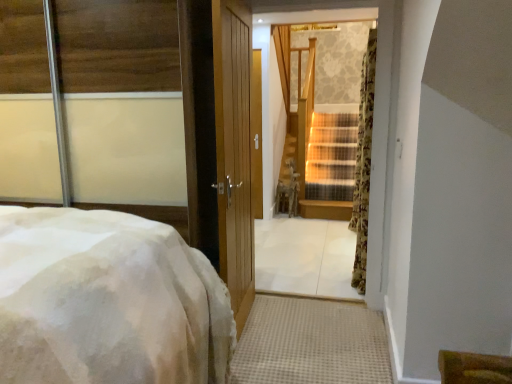
The image size is (512, 384). What do you see at coordinates (362, 164) in the screenshot?
I see `floral fabric curtain at right` at bounding box center [362, 164].

The image size is (512, 384). Describe the element at coordinates (334, 108) in the screenshot. I see `wooden staircase at center` at that location.

Where is `white fluffy bed at left`? This screenshot has height=384, width=512. white fluffy bed at left is located at coordinates (106, 301).

Looking at this image, considering the relative positions of floral fabric curtain at right and white fluffy bed at left in the image provided, is floral fabric curtain at right in front of white fluffy bed at left?

No, it is not.

Where is `bed on the left of floral fabric curtain at right`? The height and width of the screenshot is (384, 512). bed on the left of floral fabric curtain at right is located at coordinates (106, 301).

Would you say floral fabric curtain at right is inside or outside white fluffy bed at left?

The correct answer is: outside.

Is white fluffy bed at left behind wooden staircase at center?

No.

Does point (22, 232) appear closer or farther from the camera than point (329, 290)?

Clearly, point (22, 232) is closer to the camera than point (329, 290).

Is white fluffy bed at left far from wooden staircase at center?

Yes, white fluffy bed at left and wooden staircase at center are located far from each other.

Considering the relative sizes of white fluffy bed at left and wooden staircase at center in the image provided, is white fluffy bed at left taller than wooden staircase at center?

No, white fluffy bed at left is not taller than wooden staircase at center.

Considering the relative positions of white fluffy bed at left and floral fabric curtain at right in the image provided, is white fluffy bed at left to the left or to the right of floral fabric curtain at right?

From the image, it's evident that white fluffy bed at left is to the left of floral fabric curtain at right.

Does white fluffy bed at left have a greater height compared to floral fabric curtain at right?

Incorrect, the height of white fluffy bed at left is not larger of that of floral fabric curtain at right.

Is white fluffy bed at left wider or thinner than floral fabric curtain at right?

white fluffy bed at left is wider than floral fabric curtain at right.

In terms of width, does floral fabric curtain at right look wider or thinner when compared to wooden staircase at center?

In the image, floral fabric curtain at right appears to be more narrow than wooden staircase at center.

From the image's perspective, which one is positioned lower, floral fabric curtain at right or wooden staircase at center?

wooden staircase at center appears lower in the image.

This screenshot has width=512, height=384. There is a floral fabric curtain at right. What are the coordinates of `window above it (from a real-world perspective)` in the screenshot? It's located at (334, 108).

What's the angular difference between wooden staircase at center and white fluffy bed at left's facing directions?

The facing directions of wooden staircase at center and white fluffy bed at left are 88.7 degrees apart.

Is the surface of wooden staircase at center in direct contact with white fluffy bed at left?

No, wooden staircase at center is not making contact with white fluffy bed at left.

Which object is wider, wooden staircase at center or white fluffy bed at left?

With larger width is white fluffy bed at left.

Relative to white fluffy bed at left, is wooden staircase at center in front or behind?

Clearly, wooden staircase at center is behind white fluffy bed at left.

Between wooden staircase at center and floral fabric curtain at right, which one has smaller size?

With smaller size is floral fabric curtain at right.

Can you confirm if wooden staircase at center is positioned to the left of floral fabric curtain at right?

Yes, wooden staircase at center is to the left of floral fabric curtain at right.

Based on the photo, relative to floral fabric curtain at right, is wooden staircase at center in front or behind?

wooden staircase at center is in front of floral fabric curtain at right.

Is wooden staircase at center not near floral fabric curtain at right?

Yes, wooden staircase at center is far from floral fabric curtain at right.

At what (x,y) coordinates should I click in order to perform the action: click on curtain on the right side of white fluffy bed at left. Please return your answer as a coordinate pair (x, y). Looking at the image, I should click on (362, 164).

This screenshot has height=384, width=512. Identify the location of window that appears above the white fluffy bed at left (from the image's perspective). (334, 108).

When comparing their distances from wooden staircase at center, does floral fabric curtain at right or white fluffy bed at left seem closer?

floral fabric curtain at right lies closer to wooden staircase at center than the other object.

Considering their positions, is white fluffy bed at left positioned closer to wooden staircase at center than floral fabric curtain at right?

floral fabric curtain at right.

Based on their spatial positions, is wooden staircase at center or white fluffy bed at left further from floral fabric curtain at right?

The object further to floral fabric curtain at right is wooden staircase at center.

Looking at the image, which one is located further to white fluffy bed at left, floral fabric curtain at right or wooden staircase at center?

wooden staircase at center.

Estimate the real-world distances between objects in this image. Which object is further from floral fabric curtain at right, white fluffy bed at left or wooden staircase at center?

wooden staircase at center is positioned further to the anchor floral fabric curtain at right.

From the picture: Which object lies further to the anchor point white fluffy bed at left, wooden staircase at center or floral fabric curtain at right?

wooden staircase at center lies further to white fluffy bed at left than the other object.

Where is `window located between white fluffy bed at left and floral fabric curtain at right in the depth direction`? window located between white fluffy bed at left and floral fabric curtain at right in the depth direction is located at coordinates (334, 108).